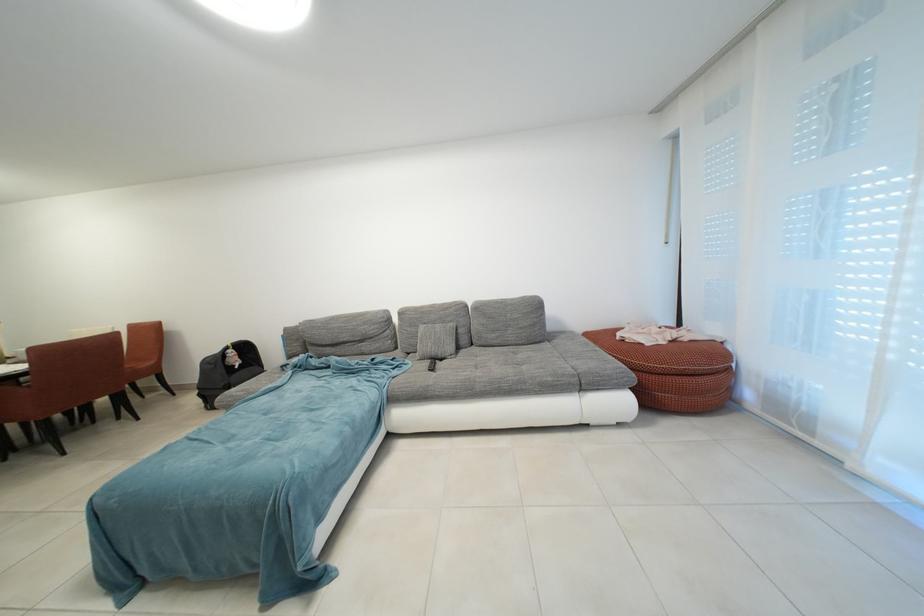
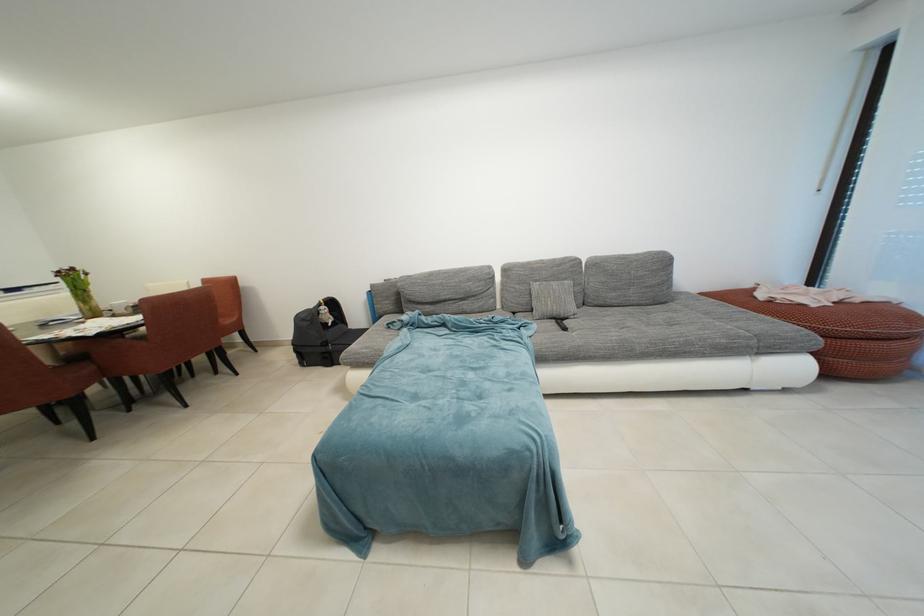
Find the pixel in the second image that matches pixel 694 344 in the first image.

(865, 305)